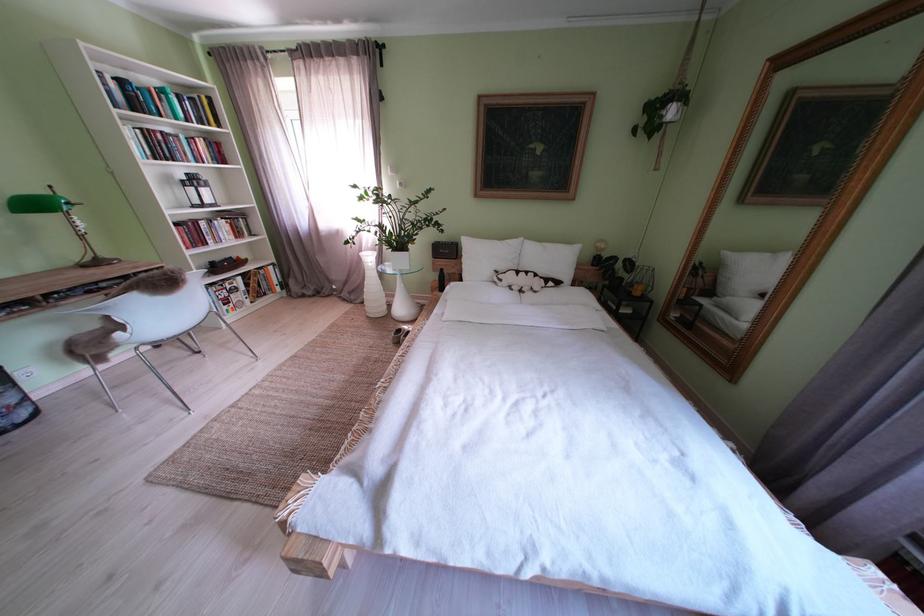
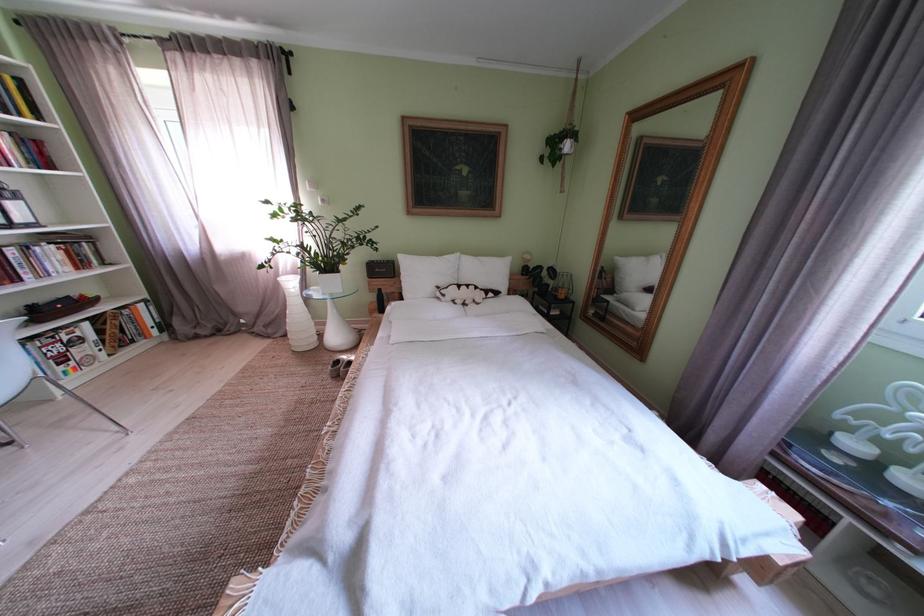
In the second image, find the point that corresponds to point 405,256 in the first image.

(333, 278)